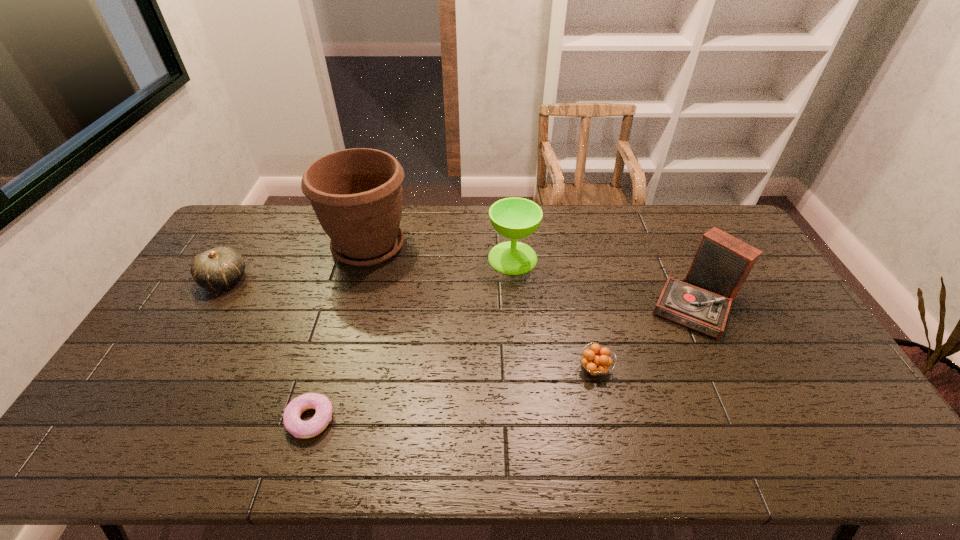
This screenshot has height=540, width=960. I want to click on free space between the gourd and the nearest object, so click(268, 349).

Where is `empty space between the tallest object and the doughnut`? empty space between the tallest object and the doughnut is located at coordinates (340, 333).

The image size is (960, 540). Identify the location of vacant area that lies between the second nearest object and the wineglass. (553, 314).

Image resolution: width=960 pixels, height=540 pixels. In order to click on free point between the leftmost object and the fifth tallest object in this screenshot , I will do `click(410, 325)`.

Select which object appears as the third closest to the leftmost object. Please provide its 2D coordinates. Your answer should be formatted as a tuple, i.e. [(x, y)], where the tuple contains the x and y coordinates of a point satisfying the conditions above.

[(515, 218)]

This screenshot has width=960, height=540. Find the location of `object that can be found as the fifth closest to the doughnut`. object that can be found as the fifth closest to the doughnut is located at coordinates (722, 263).

The width and height of the screenshot is (960, 540). I want to click on free point that satisfies the following two spatial constraints: 1. on the front side of the rightmost object; 2. on the right side of the third object from right to left, so click(x=516, y=304).

This screenshot has width=960, height=540. In order to click on free location that satisfies the following two spatial constraints: 1. on the back side of the nearest object; 2. on the left side of the fourth object from left to right in this screenshot , I will do `click(358, 258)`.